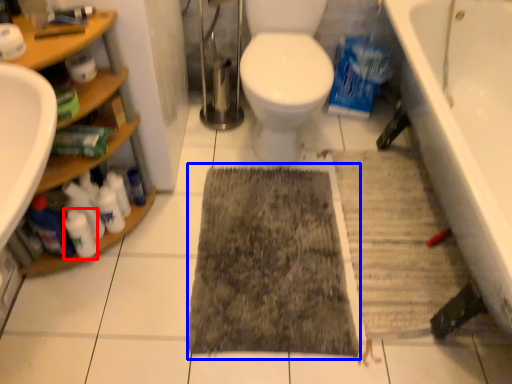
Question: Which point is further to the camera, cleaning product (highlighted by a red box) or doormat (highlighted by a blue box)?

Choices:
 (A) cleaning product
 (B) doormat

Answer: (B)